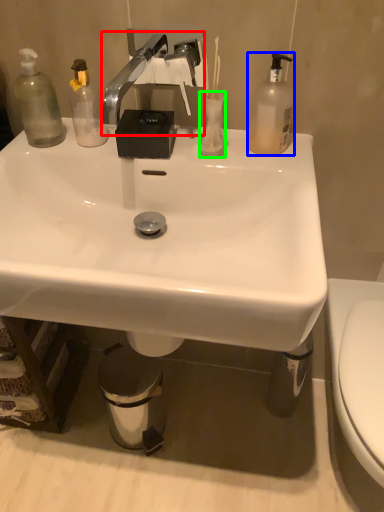
Question: Which object is the farthest from faucet (highlighted by a red box)? Choose among these: bottle (highlighted by a blue box) or toilet paper (highlighted by a green box).

Choices:
 (A) bottle
 (B) toilet paper

Answer: (A)